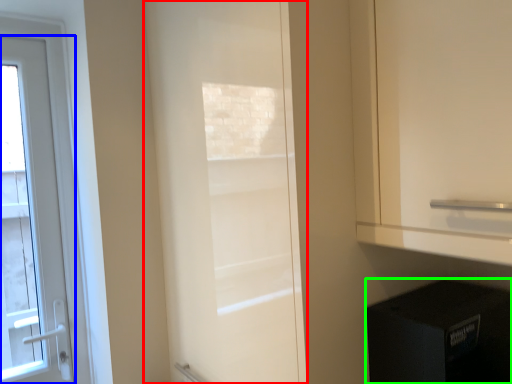
Question: Considering the real-world distances, which object is farthest from door (highlighted by a red box)? door (highlighted by a blue box) or appliance (highlighted by a green box)?

Choices:
 (A) door
 (B) appliance

Answer: (A)